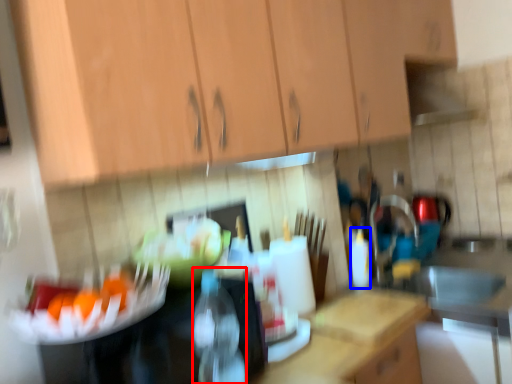
Question: Among these objects, which one is farthest to the camera, bottle (highlighted by a red box) or bottle (highlighted by a blue box)?

Choices:
 (A) bottle
 (B) bottle

Answer: (B)